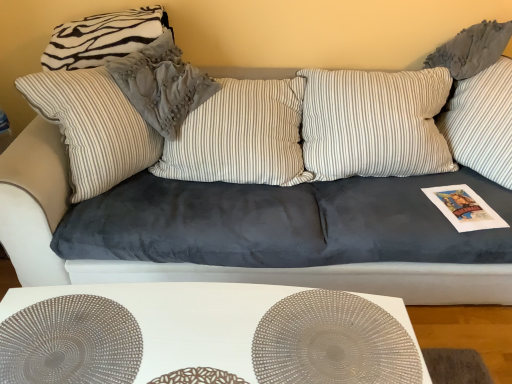
Locate an element on the screen. free space above satin silver circle at center, which is the first circle from left to right (from a real-world perspective) is located at coordinates pos(68,341).